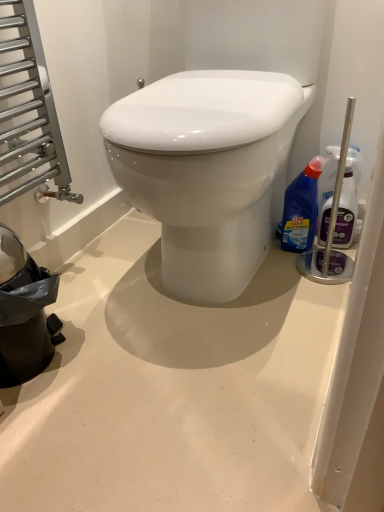
The image size is (384, 512). Identify the location of blue plastic bottle at right, which is the first bottle in left-to-right order. (301, 209).

What do you see at coordinates (301, 209) in the screenshot?
I see `blue plastic bottle at right, which appears as the 2th bottle when viewed from the right` at bounding box center [301, 209].

You are a GUI agent. You are given a task and a screenshot of the screen. Output one action in this format:
    pyautogui.click(x=<x>, y=<y>)
    Task: Click on the purple plastic cleaner at right, acting as the 2th bottle starting from the left
    
    Given the screenshot: What is the action you would take?
    pyautogui.click(x=348, y=204)

Describe the element at coordinates (348, 204) in the screenshot. Image resolution: width=384 pixels, height=512 pixels. I see `purple plastic cleaner at right, acting as the 2th bottle starting from the left` at that location.

Identify the location of blue plastic bottle at right, which is the first bottle in left-to-right order. (301, 209).

Would you say blue plastic bottle at right, which is the first bottle in left-to-right order, is to the left or to the right of purple plastic cleaner at right, acting as the 2th bottle starting from the left, in the picture?

blue plastic bottle at right, which is the first bottle in left-to-right order, is positioned on purple plastic cleaner at right, acting as the 2th bottle starting from the left,'s left side.

Is the depth of blue plastic bottle at right, which is the first bottle in left-to-right order, less than that of purple plastic cleaner at right, which appears as the 1th bottle when viewed from the right?

No, it is not.

Does point (301, 203) come farther from viewer compared to point (352, 213)?

No, it is not.

In the scene shown: From the image's perspective, between blue plastic bottle at right, which appears as the 2th bottle when viewed from the right, and purple plastic cleaner at right, acting as the 2th bottle starting from the left, who is located below?

From the image's view, blue plastic bottle at right, which appears as the 2th bottle when viewed from the right, is below.

From a real-world perspective, which is physically above, blue plastic bottle at right, which is the first bottle in left-to-right order, or purple plastic cleaner at right, acting as the 2th bottle starting from the left?

In real-world perspective, purple plastic cleaner at right, acting as the 2th bottle starting from the left, is above.

Looking at this image, between blue plastic bottle at right, which is the first bottle in left-to-right order, and purple plastic cleaner at right, acting as the 2th bottle starting from the left, which one has smaller width?

purple plastic cleaner at right, acting as the 2th bottle starting from the left.

Considering the sizes of objects blue plastic bottle at right, which is the first bottle in left-to-right order, and purple plastic cleaner at right, which appears as the 1th bottle when viewed from the right, in the image provided, who is taller, blue plastic bottle at right, which is the first bottle in left-to-right order, or purple plastic cleaner at right, which appears as the 1th bottle when viewed from the right,?

Standing taller between the two is purple plastic cleaner at right, which appears as the 1th bottle when viewed from the right.

Which of these two, blue plastic bottle at right, which is the first bottle in left-to-right order, or purple plastic cleaner at right, acting as the 2th bottle starting from the left, is bigger?

blue plastic bottle at right, which is the first bottle in left-to-right order, is bigger.

Is blue plastic bottle at right, which is the first bottle in left-to-right order, located outside purple plastic cleaner at right, acting as the 2th bottle starting from the left?

Yes, blue plastic bottle at right, which is the first bottle in left-to-right order, is located beyond the bounds of purple plastic cleaner at right, acting as the 2th bottle starting from the left.

Is blue plastic bottle at right, which is the first bottle in left-to-right order, not close to purple plastic cleaner at right, acting as the 2th bottle starting from the left?

That's not correct — blue plastic bottle at right, which is the first bottle in left-to-right order, is a little close to purple plastic cleaner at right, acting as the 2th bottle starting from the left.

Is purple plastic cleaner at right, which appears as the 1th bottle when viewed from the right, at the back of blue plastic bottle at right, which is the first bottle in left-to-right order?

No.

The image size is (384, 512). Find the location of `bottle behind the purple plastic cleaner at right, which appears as the 1th bottle when viewed from the right`. bottle behind the purple plastic cleaner at right, which appears as the 1th bottle when viewed from the right is located at coordinates (301, 209).

Does purple plastic cleaner at right, acting as the 2th bottle starting from the left, appear on the right side of blue plastic bottle at right, which is the first bottle in left-to-right order?

Correct, you'll find purple plastic cleaner at right, acting as the 2th bottle starting from the left, to the right of blue plastic bottle at right, which is the first bottle in left-to-right order.

Which object is more forward, purple plastic cleaner at right, which appears as the 1th bottle when viewed from the right, or blue plastic bottle at right, which appears as the 2th bottle when viewed from the right?

purple plastic cleaner at right, which appears as the 1th bottle when viewed from the right.

Is point (317, 230) positioned before point (310, 201)?

No.

From the image's perspective, which is below, purple plastic cleaner at right, which appears as the 1th bottle when viewed from the right, or blue plastic bottle at right, which is the first bottle in left-to-right order?

From the image's view, blue plastic bottle at right, which is the first bottle in left-to-right order, is below.

From a real-world perspective, is purple plastic cleaner at right, which appears as the 1th bottle when viewed from the right, located higher than blue plastic bottle at right, which is the first bottle in left-to-right order?

Yes, from a real-world perspective, purple plastic cleaner at right, which appears as the 1th bottle when viewed from the right, is over blue plastic bottle at right, which is the first bottle in left-to-right order

Looking at this image, which object is wider, purple plastic cleaner at right, acting as the 2th bottle starting from the left, or blue plastic bottle at right, which is the first bottle in left-to-right order?

With larger width is blue plastic bottle at right, which is the first bottle in left-to-right order.

Looking at this image, does purple plastic cleaner at right, which appears as the 1th bottle when viewed from the right, have a greater height compared to blue plastic bottle at right, which appears as the 2th bottle when viewed from the right?

Indeed, purple plastic cleaner at right, which appears as the 1th bottle when viewed from the right, has a greater height compared to blue plastic bottle at right, which appears as the 2th bottle when viewed from the right.

Is purple plastic cleaner at right, which appears as the 1th bottle when viewed from the right, smaller than blue plastic bottle at right, which appears as the 2th bottle when viewed from the right?

Yes, purple plastic cleaner at right, which appears as the 1th bottle when viewed from the right, is smaller than blue plastic bottle at right, which appears as the 2th bottle when viewed from the right.

Could blue plastic bottle at right, which appears as the 2th bottle when viewed from the right, be considered to be inside purple plastic cleaner at right, acting as the 2th bottle starting from the left?

No, blue plastic bottle at right, which appears as the 2th bottle when viewed from the right, is not inside purple plastic cleaner at right, acting as the 2th bottle starting from the left.

Does purple plastic cleaner at right, acting as the 2th bottle starting from the left, touch blue plastic bottle at right, which appears as the 2th bottle when viewed from the right?

Yes, purple plastic cleaner at right, acting as the 2th bottle starting from the left, and blue plastic bottle at right, which appears as the 2th bottle when viewed from the right, clearly make contact.

Is purple plastic cleaner at right, acting as the 2th bottle starting from the left, turned away from blue plastic bottle at right, which is the first bottle in left-to-right order?

No, purple plastic cleaner at right, acting as the 2th bottle starting from the left, is not facing the opposite direction of blue plastic bottle at right, which is the first bottle in left-to-right order.

Can you tell me how much purple plastic cleaner at right, acting as the 2th bottle starting from the left, and blue plastic bottle at right, which appears as the 2th bottle when viewed from the right, differ in facing direction?

There is a 1.23-degree angle between the facing directions of purple plastic cleaner at right, acting as the 2th bottle starting from the left, and blue plastic bottle at right, which appears as the 2th bottle when viewed from the right.

Measure the distance between purple plastic cleaner at right, which appears as the 1th bottle when viewed from the right, and blue plastic bottle at right, which is the first bottle in left-to-right order.

They are 2.98 inches apart.

Where is `bottle on the right side of blue plastic bottle at right, which is the first bottle in left-to-right order`? The width and height of the screenshot is (384, 512). bottle on the right side of blue plastic bottle at right, which is the first bottle in left-to-right order is located at coordinates (348, 204).

Where is `bottle on the right of blue plastic bottle at right, which appears as the 2th bottle when viewed from the right`? bottle on the right of blue plastic bottle at right, which appears as the 2th bottle when viewed from the right is located at coordinates (348, 204).

Locate an element on the screen. This screenshot has width=384, height=512. bottle below the purple plastic cleaner at right, which appears as the 1th bottle when viewed from the right (from the image's perspective) is located at coordinates (301, 209).